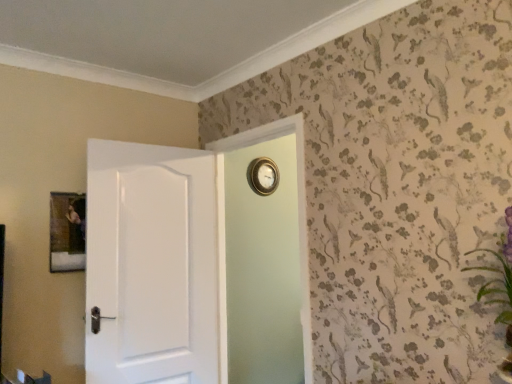
Question: Does gold metallic clock at upper center have a larger size compared to gold metallic clock at upper center?

Choices:
 (A) no
 (B) yes

Answer: (B)

Question: Does gold metallic clock at upper center have a lesser height compared to gold metallic clock at upper center?

Choices:
 (A) yes
 (B) no

Answer: (B)

Question: From the image's perspective, is gold metallic clock at upper center below gold metallic clock at upper center?

Choices:
 (A) yes
 (B) no

Answer: (A)

Question: Is gold metallic clock at upper center located outside gold metallic clock at upper center?

Choices:
 (A) no
 (B) yes

Answer: (B)

Question: Considering the relative positions of gold metallic clock at upper center and gold metallic clock at upper center in the image provided, is gold metallic clock at upper center to the right of gold metallic clock at upper center from the viewer's perspective?

Choices:
 (A) no
 (B) yes

Answer: (A)

Question: From the image's perspective, does gold metallic clock at upper center appear higher than gold metallic clock at upper center?

Choices:
 (A) yes
 (B) no

Answer: (B)

Question: Is wooden picture frame at upper left at the left side of gold metallic clock at upper center?

Choices:
 (A) no
 (B) yes

Answer: (B)

Question: Is wooden picture frame at upper left aimed at gold metallic clock at upper center?

Choices:
 (A) yes
 (B) no

Answer: (B)

Question: Is wooden picture frame at upper left far away from gold metallic clock at upper center?

Choices:
 (A) yes
 (B) no

Answer: (A)

Question: Does wooden picture frame at upper left come in front of gold metallic clock at upper center?

Choices:
 (A) no
 (B) yes

Answer: (B)

Question: Is wooden picture frame at upper left thinner than gold metallic clock at upper center?

Choices:
 (A) no
 (B) yes

Answer: (B)

Question: Does wooden picture frame at upper left have a lesser height compared to gold metallic clock at upper center?

Choices:
 (A) no
 (B) yes

Answer: (A)

Question: Can you confirm if wooden picture frame at upper left is smaller than white glossy door at left?

Choices:
 (A) no
 (B) yes

Answer: (B)